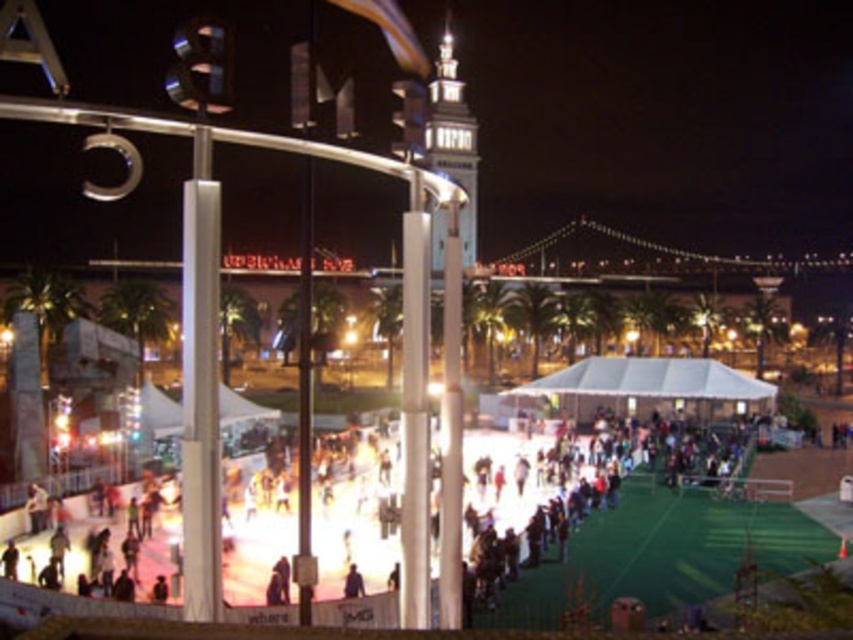
Question: Can you confirm if dark clothing at center is smaller than white glossy tower at center?

Choices:
 (A) no
 (B) yes

Answer: (B)

Question: Is dark clothing at center in front of white glossy tower at center?

Choices:
 (A) no
 (B) yes

Answer: (B)

Question: Which point appears closest to the camera in this image?

Choices:
 (A) (450, 35)
 (B) (434, 563)

Answer: (B)

Question: Which of the following is the closest to the observer?

Choices:
 (A) dark clothing at center
 (B) white glossy tower at center

Answer: (A)

Question: Can you confirm if dark clothing at center is positioned to the left of white glossy tower at center?

Choices:
 (A) yes
 (B) no

Answer: (B)